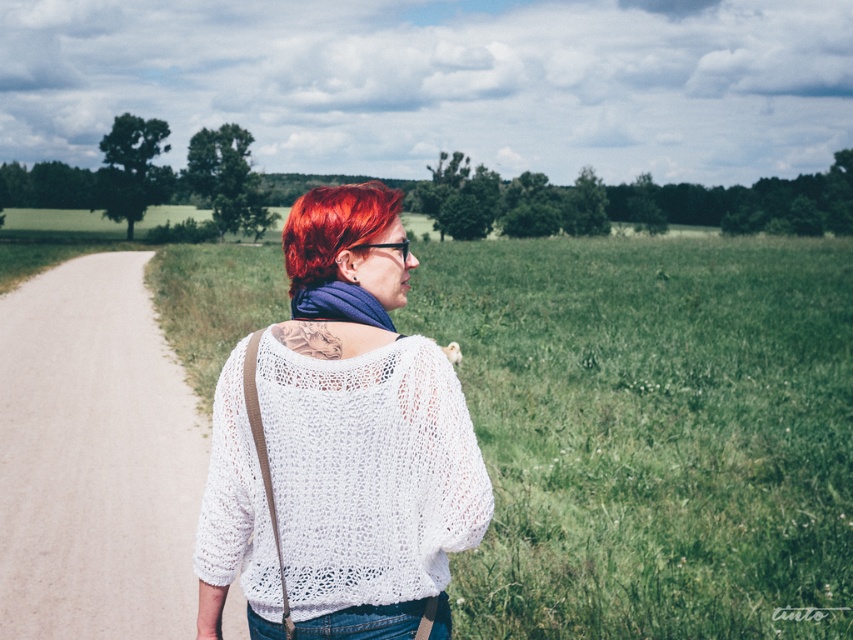
You are a GUI agent. You are given a task and a screenshot of the screen. Output one action in this format:
    pyautogui.click(x=<x>, y=<y>)
    Task: Click on the dirt road at left
    Image resolution: width=853 pixels, height=640 pixels.
    Given the screenshot: What is the action you would take?
    pyautogui.click(x=96, y=458)

Which is behind, point (6, 497) or point (317, 627)?

The point (6, 497) is more distant.

Image resolution: width=853 pixels, height=640 pixels. I want to click on dirt road at left, so click(96, 458).

Does green grass at center appear under denim at center?

No, green grass at center is not below denim at center.

Is green grass at center taller than denim at center?

Indeed, green grass at center has a greater height compared to denim at center.

Identify the location of green grass at center. This screenshot has height=640, width=853. (653, 433).

The image size is (853, 640). Describe the element at coordinates (653, 433) in the screenshot. I see `green grass at center` at that location.

Is green grass at center smaller than dirt road at left?

No.

Who is more distant from viewer, (624, 429) or (131, 563)?

The point (624, 429) is more distant.

Identify the location of green grass at center. (653, 433).